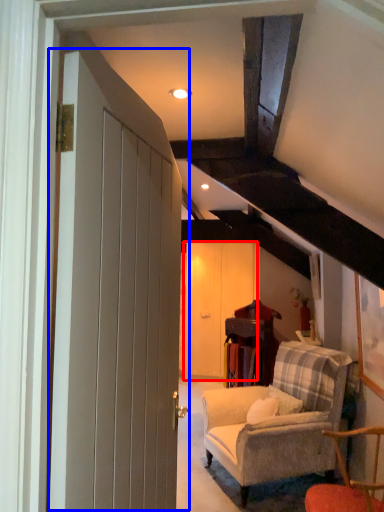
Question: Which object is closer to the camera taking this photo, barn door (highlighted by a red box) or door (highlighted by a blue box)?

Choices:
 (A) barn door
 (B) door

Answer: (B)